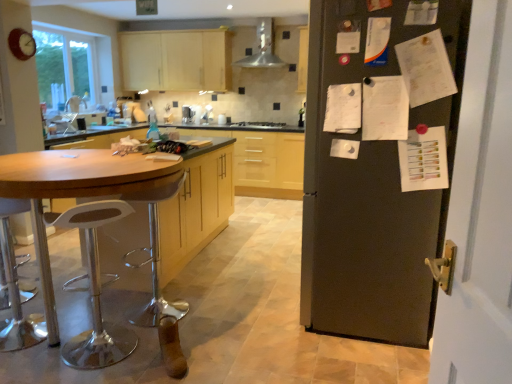
I want to click on vacant space underneath wooden table at left (from a real-world perspective), so click(x=81, y=313).